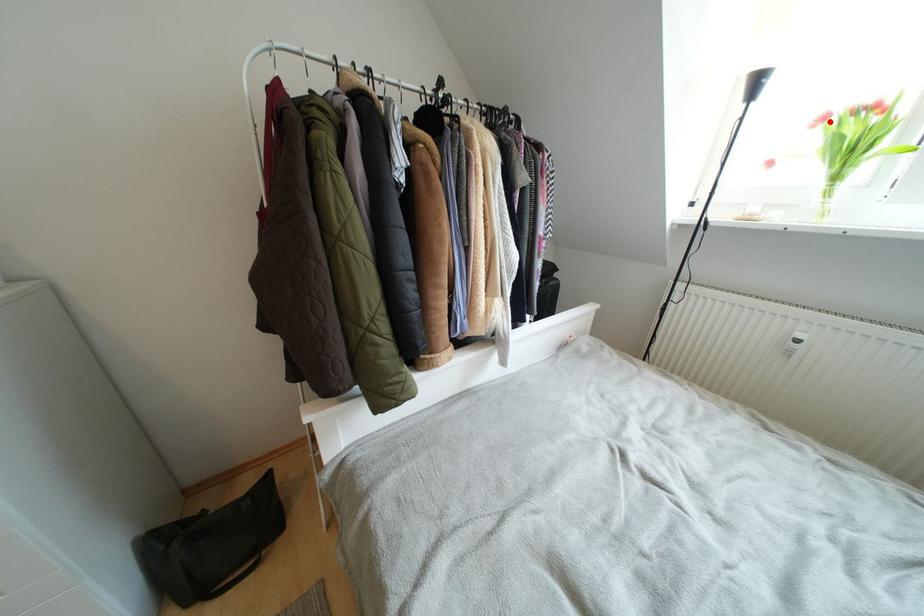
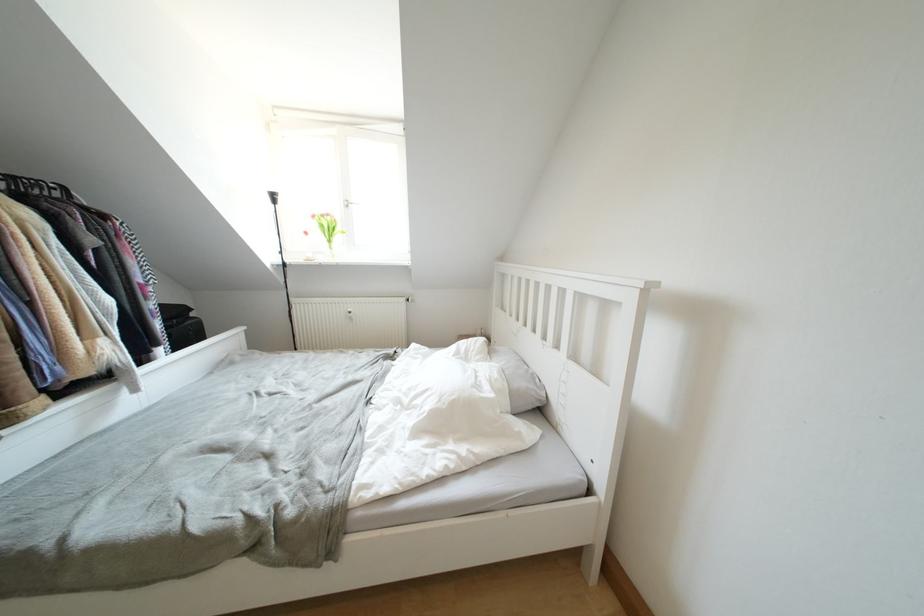
Question: I am providing you with two images of the same scene from different viewpoints. Given a red point in image1, look at the same physical point in image2. Is it:

Choices:
 (A) Closer to the viewpoint
 (B) Farther from the viewpoint

Answer: (A)